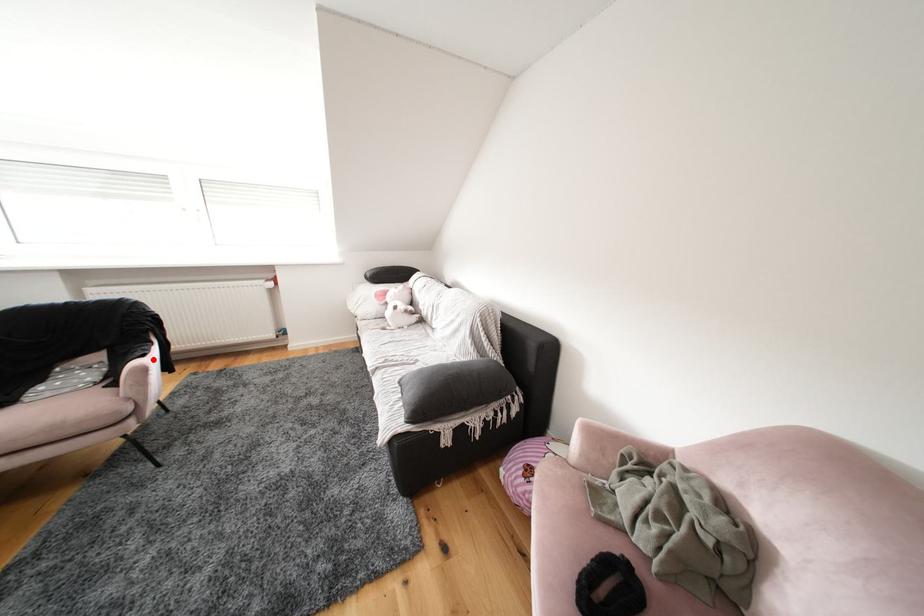
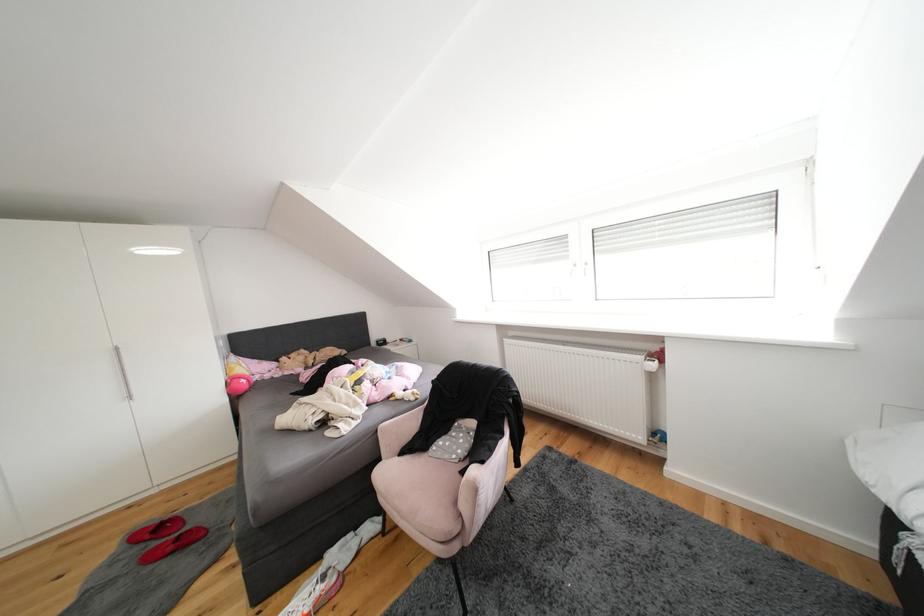
In the second image, find the point that corresponds to the highlighted location in the first image.

(492, 466)